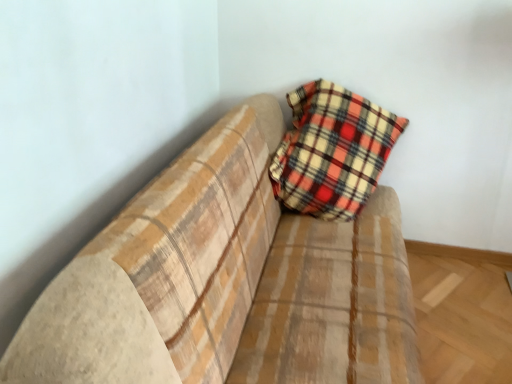
Question: From the image's perspective, is plaid fabric couch at upper right above or below plaid fabric pillow at center?

Choices:
 (A) above
 (B) below

Answer: (B)

Question: Considering their positions, is plaid fabric couch at upper right located in front of or behind plaid fabric pillow at center?

Choices:
 (A) behind
 (B) front

Answer: (B)

Question: From a real-world perspective, is plaid fabric couch at upper right above or below plaid fabric pillow at center?

Choices:
 (A) above
 (B) below

Answer: (B)

Question: From a real-world perspective, is plaid fabric pillow at center positioned above or below plaid fabric couch at upper right?

Choices:
 (A) below
 (B) above

Answer: (B)

Question: From the image's perspective, relative to plaid fabric couch at upper right, is plaid fabric pillow at center above or below?

Choices:
 (A) above
 (B) below

Answer: (A)

Question: Visually, is plaid fabric pillow at center positioned to the left or to the right of plaid fabric couch at upper right?

Choices:
 (A) left
 (B) right

Answer: (B)

Question: In terms of size, does plaid fabric pillow at center appear bigger or smaller than plaid fabric couch at upper right?

Choices:
 (A) big
 (B) small

Answer: (B)